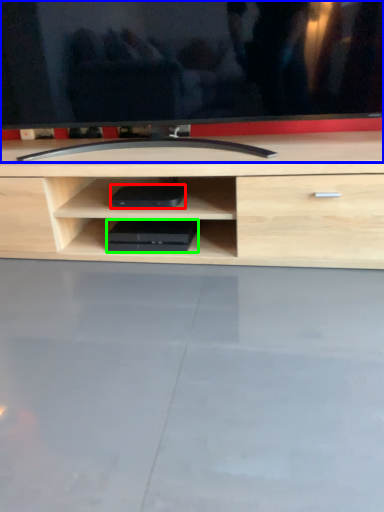
Question: Estimate the real-world distances between objects in this image. Which object is closer to equipment (highlighted by a red box), television (highlighted by a blue box) or equipment (highlighted by a green box)?

Choices:
 (A) television
 (B) equipment

Answer: (B)